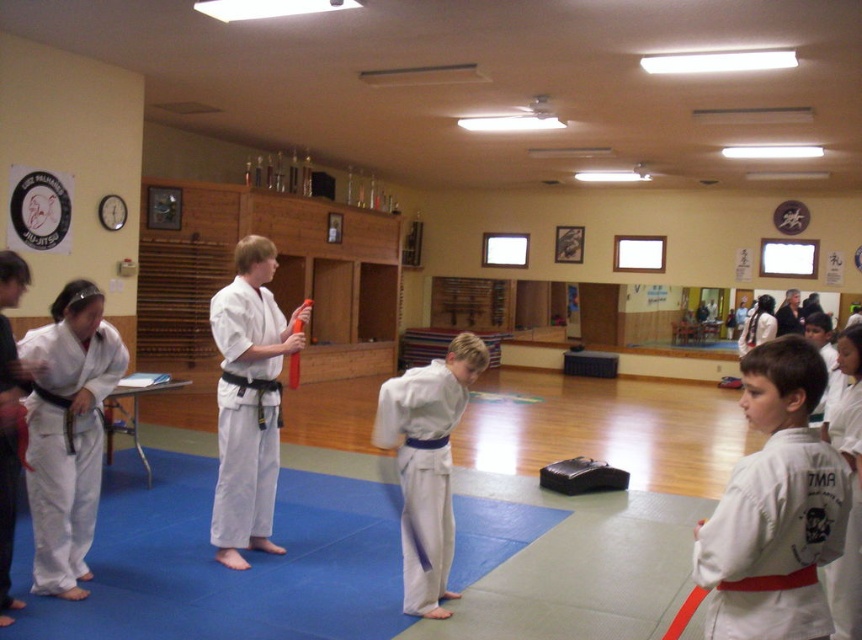
Question: Among these objects, which one is nearest to the camera?

Choices:
 (A) white matte kimono at center
 (B) white cotton kimono at center

Answer: (A)

Question: Is white matte kimono at center to the right of white cotton kimono at center from the viewer's perspective?

Choices:
 (A) no
 (B) yes

Answer: (B)

Question: Which point is farther to the camera?

Choices:
 (A) white cotton kimono at center
 (B) white matte kimono at center

Answer: (A)

Question: Which of the following is the farthest from the observer?

Choices:
 (A) white matte kimono at center
 (B) white cotton kimono at center

Answer: (B)

Question: Is white matte kimono at center bigger than white cotton kimono at center?

Choices:
 (A) yes
 (B) no

Answer: (B)

Question: Where is white matte kimono at center located in relation to white cotton kimono at center in the image?

Choices:
 (A) left
 (B) right

Answer: (B)